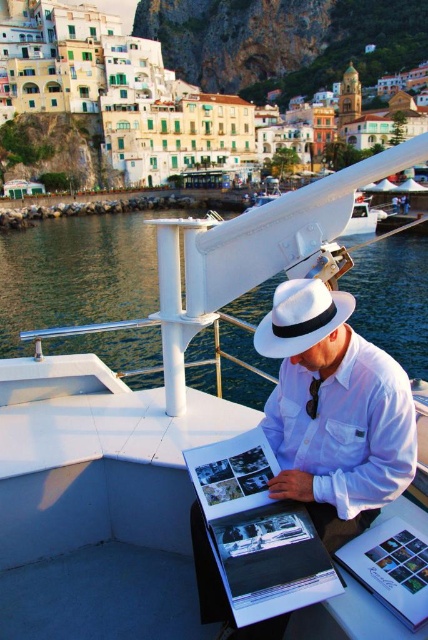
From the picture: You are a photographer standing on the deck of the boat. You want to take a photo of both the white cotton shirt at center and the black satin tie at center in the same frame. The camera you are using has a maximum zoom range that can capture objects up to 3 meters apart. Will you be able to include both objects in a single photo without moving the camera?

The distance between the white cotton shirt at center and the black satin tie at center is 3.41 meters. Since the camera can only capture up to 3 meters apart, the objects are too far apart to be included in a single photo without moving the camera.

Based on the photo, you are a photographer on the boat and want to take a picture of the man. You need to ensure the white cotton shirt at center and the white felt hat at center are both visible. Which object should be placed to the left in the frame to achieve this?

The white felt hat at center should be placed to the left in the frame because the white cotton shirt at center is positioned on the right side of the white felt hat at center, so arranging the hat to the left will keep both items within the frame.